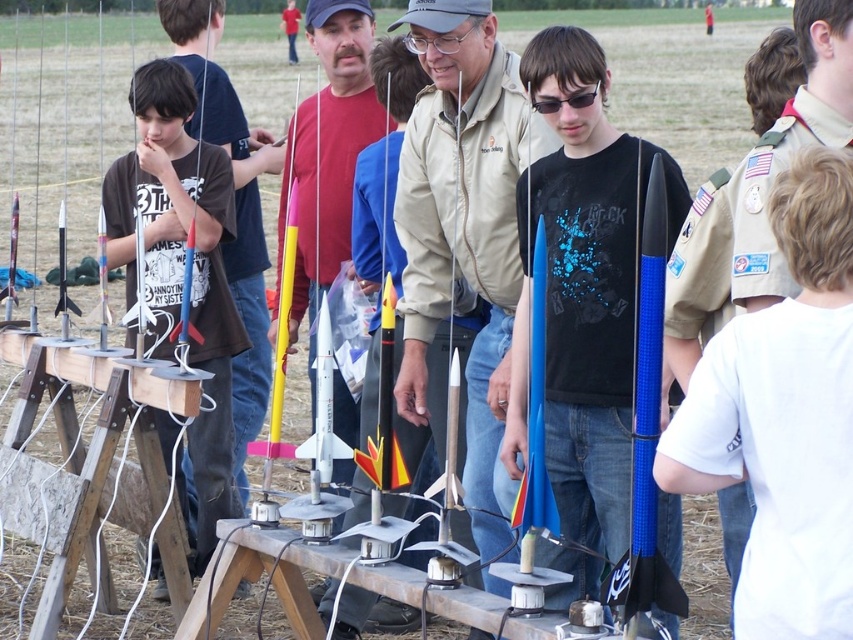
Question: Which object appears farthest from the camera in this image?

Choices:
 (A) black plastic goggles at center
 (B) blue textured pole at center

Answer: (A)

Question: Among these objects, which one is nearest to the camera?

Choices:
 (A) black plastic goggles at center
 (B) matte khaki jacket at center
 (C) blue textured pole at center
 (D) matte black t-shirt at left

Answer: (C)

Question: Is blue matte rocket at center to the right of black plastic goggles at center from the viewer's perspective?

Choices:
 (A) yes
 (B) no

Answer: (A)

Question: Considering the relative positions of white cotton shirt at center and black plastic goggles at center in the image provided, where is white cotton shirt at center located with respect to black plastic goggles at center?

Choices:
 (A) below
 (B) above

Answer: (A)

Question: Among these points, which one is farthest from the camera?

Choices:
 (A) (610, 589)
 (B) (587, 189)
 (C) (579, 96)

Answer: (B)

Question: Is matte black t-shirt at left above blue textured pole at center?

Choices:
 (A) yes
 (B) no

Answer: (A)